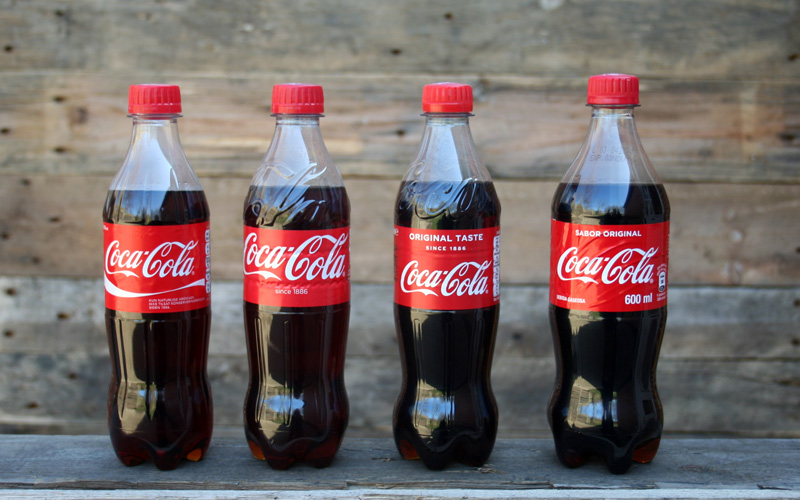
At what (x,y) coordinates should I click in order to perform the action: click on bottles of cola. Please return your answer as a coordinate pair (x, y). This screenshot has width=800, height=500. Looking at the image, I should click on (152, 217), (330, 210), (438, 225), (604, 239).